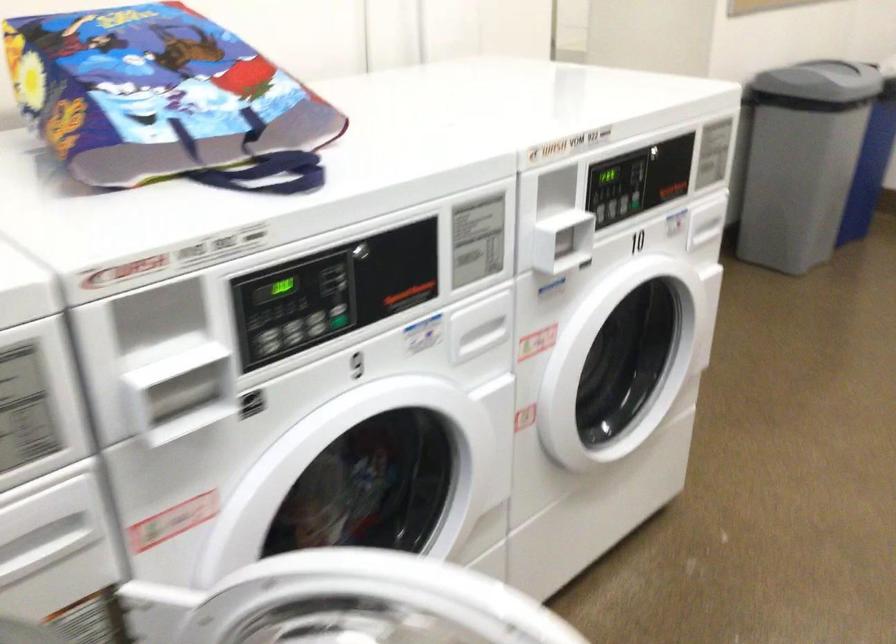
Question: How did the camera likely rotate?

Choices:
 (A) Left
 (B) Right
 (C) Up
 (D) Down

Answer: (A)